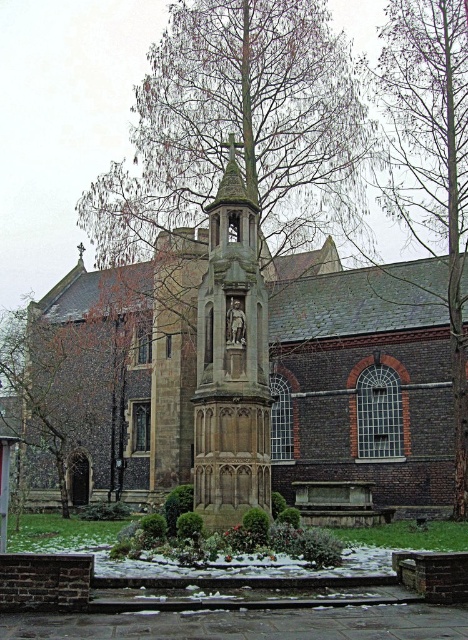
Does brown stone church at center have a lesser height compared to bare wood tree at right?

Yes.

Is brown stone church at center thinner than bare wood tree at right?

Incorrect, brown stone church at center's width is not less than bare wood tree at right's.

Identify the location of brown stone church at center. (263, 362).

Locate an element on the screen. This screenshot has width=468, height=640. brown stone church at center is located at coordinates (263, 362).

Between brown stone church at center and stone statue at center, which one is positioned lower?

brown stone church at center is below.

How much distance is there between brown stone church at center and stone statue at center?

They are 37.21 feet apart.

Find the location of a particular element. The width and height of the screenshot is (468, 640). brown stone church at center is located at coordinates (263, 362).

Is bare wood tree at right further to the viewer compared to stone statue at center?

Yes, bare wood tree at right is behind stone statue at center.

Does bare wood tree at right have a smaller size compared to stone statue at center?

No.

Which is in front, point (461, 509) or point (246, 288)?

Positioned in front is point (246, 288).

Locate an element on the screen. bare wood tree at right is located at coordinates (431, 161).